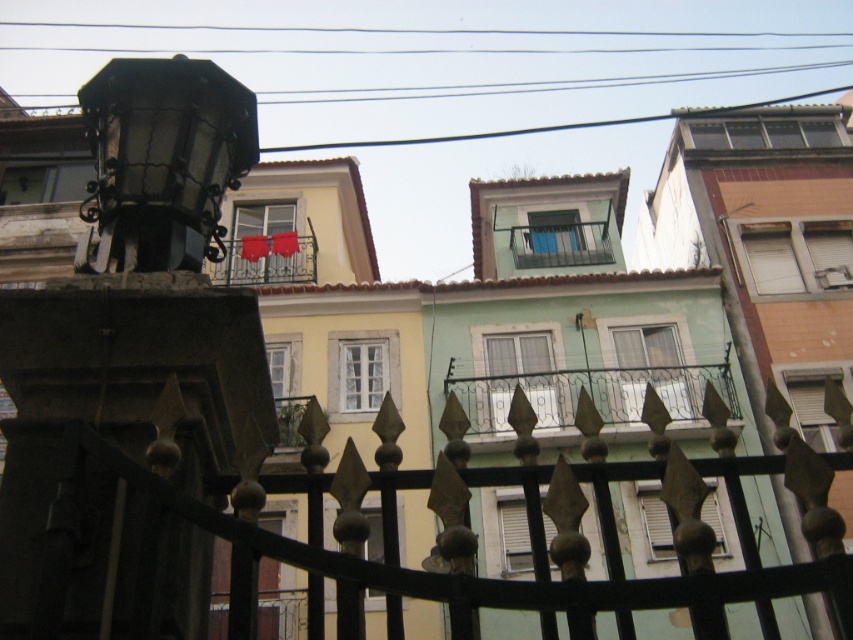
Question: Can you confirm if green wrought iron balcony at center is positioned to the left of metallic balcony at center?

Choices:
 (A) yes
 (B) no

Answer: (B)

Question: Which of the following is the farthest from the observer?

Choices:
 (A) metallic balcony at center
 (B) metallic gray balcony at center
 (C) black wrought iron fence at center

Answer: (B)

Question: Does metallic gray balcony at center appear under metallic balcony at center?

Choices:
 (A) yes
 (B) no

Answer: (B)

Question: Can you confirm if metallic gray balcony at center is thinner than metallic balcony at center?

Choices:
 (A) no
 (B) yes

Answer: (B)

Question: Which of the following is the closest to the observer?

Choices:
 (A) (231, 538)
 (B) (555, 246)
 (C) (257, 260)

Answer: (A)

Question: Which object appears farthest from the camera in this image?

Choices:
 (A) black wrought iron fence at center
 (B) green wrought iron balcony at center
 (C) metallic balcony at center
 (D) metallic gray balcony at center

Answer: (D)